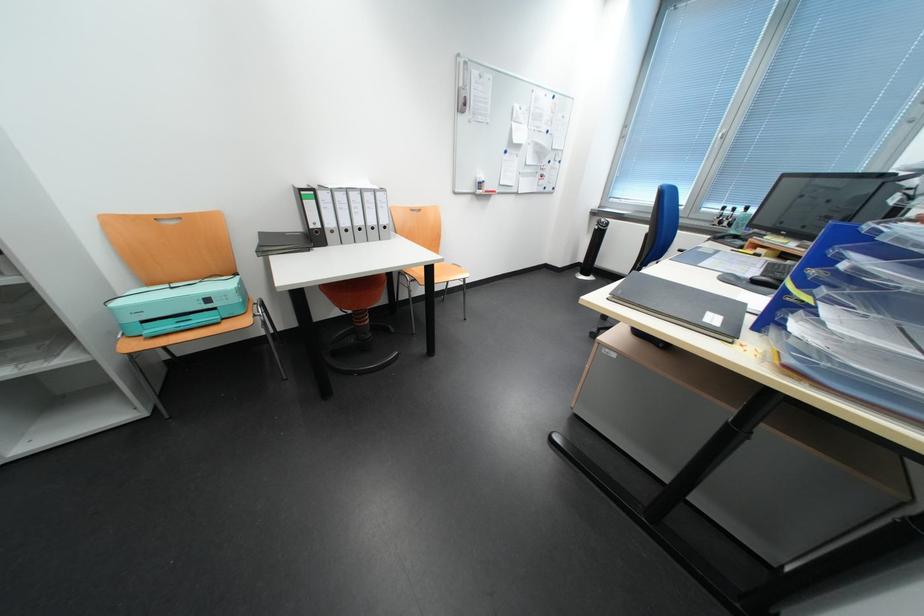
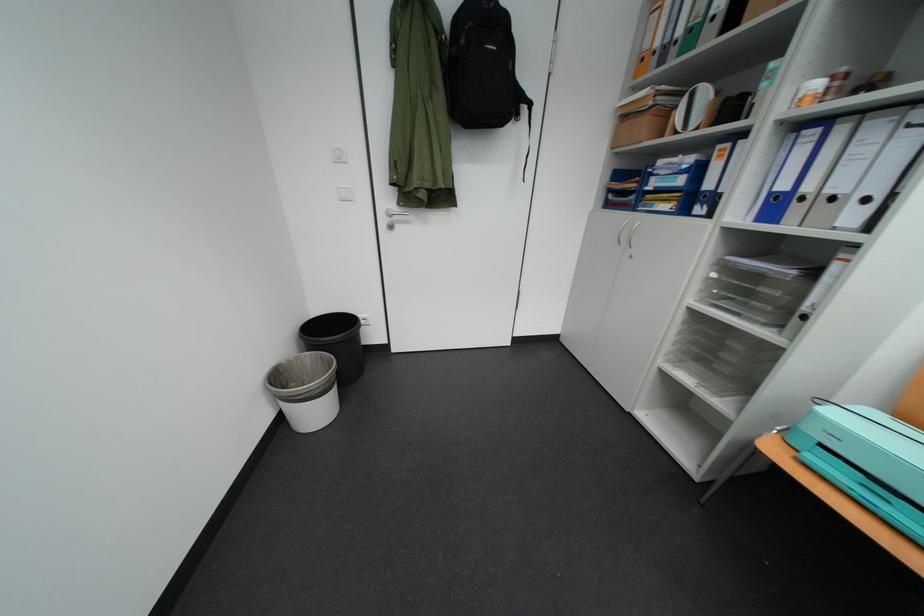
Find the pixel in the second image that matches (x=144, y=349) in the first image.

(784, 451)